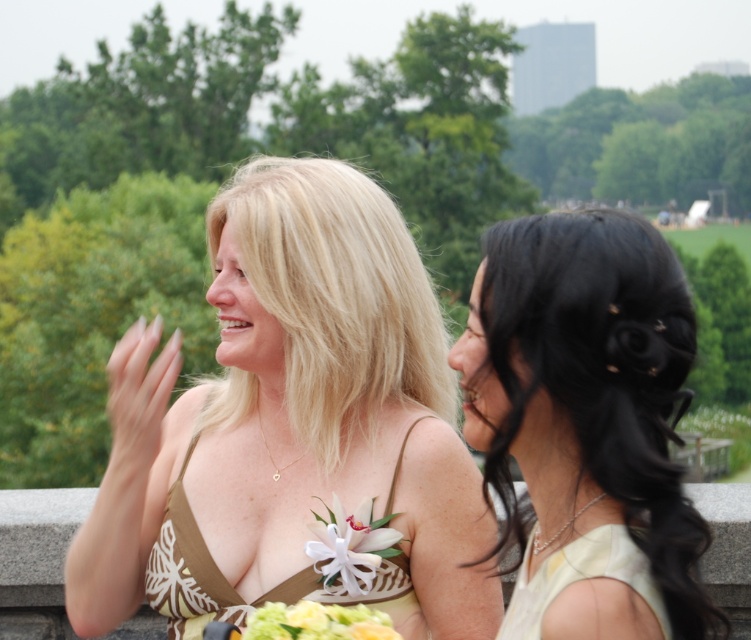
You are a photographer at a social event and want to capture a closeup shot of the black shiny hair at right and the floral bouquet at center. Which object should you focus on first to ensure it appears sharp in the photo?

You should focus on the black shiny hair at right first because it is closer to the viewer than the floral bouquet at center.

You are a photographer at an outdoor event. You want to capture a photo where both the matte gold dress at center and the white satin dress at lower right are clearly visible. Given their positions, which dress should you focus on to ensure both are in frame?

The white satin dress at lower right is behind the matte gold dress at center, so focusing on the matte gold dress at center will keep both in frame as the white satin dress at lower right will be visible behind it.